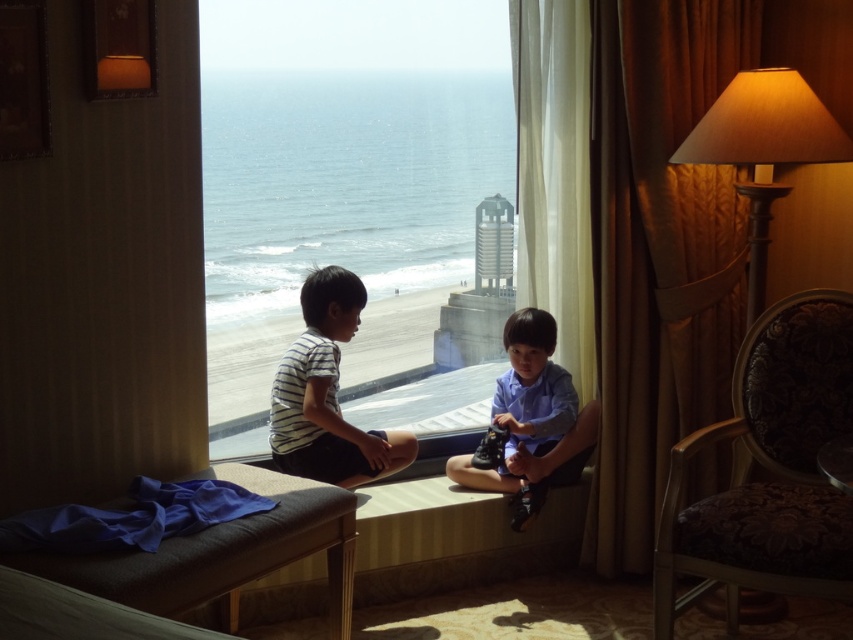
Consider the image. You are a guest in this hotel room and want to look outside through the transparent glass window at center. However, there is a matte beige lampshade at right nearby. Which object should you approach first to have an unobstructed view of the ocean?

To have an unobstructed view of the ocean, you should approach the transparent glass window at center first since it is positioned to the left of the matte beige lampshade at right, meaning it is closer to the ocean side of the room.